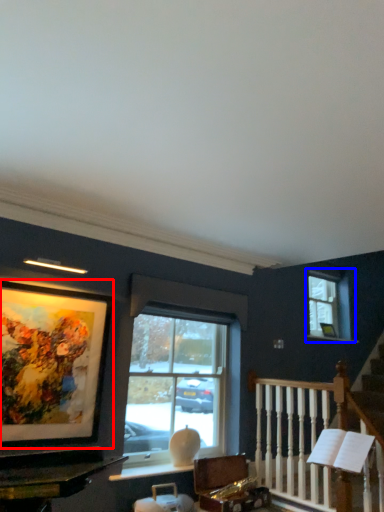
Question: Which object is further to the camera taking this photo, picture frame (highlighted by a red box) or window (highlighted by a blue box)?

Choices:
 (A) picture frame
 (B) window

Answer: (B)